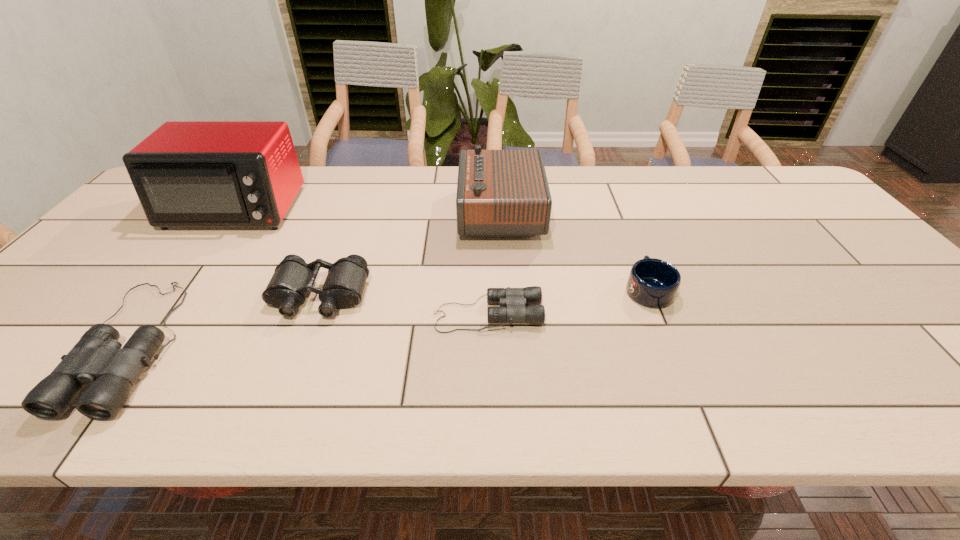
Identify which binoculars is the closest to the radio receiver. Please provide its 2D coordinates. Your answer should be formatted as a tuple, i.e. [(x, y)], where the tuple contains the x and y coordinates of a point satisfying the conditions above.

[(515, 299)]

Select which binoculars appears as the second closest to the tallest object. Please provide its 2D coordinates. Your answer should be formatted as a tuple, i.e. [(x, y)], where the tuple contains the x and y coordinates of a point satisfying the conditions above.

[(97, 358)]

This screenshot has height=540, width=960. Identify the location of vacant space that satisfies the following two spatial constraints: 1. on the front panel of the radio receiver; 2. at the eyepiece of the leftmost binoculars. (509, 343).

Identify the location of free location that satisfies the following two spatial constraints: 1. on the front panel of the fifth shortest object; 2. through the eyepieces of the third object from left to right. This screenshot has height=540, width=960. (506, 296).

Image resolution: width=960 pixels, height=540 pixels. I want to click on vacant area that satisfies the following two spatial constraints: 1. with the handle on the side of the rightmost object; 2. on the front panel of the second tallest object, so click(x=616, y=213).